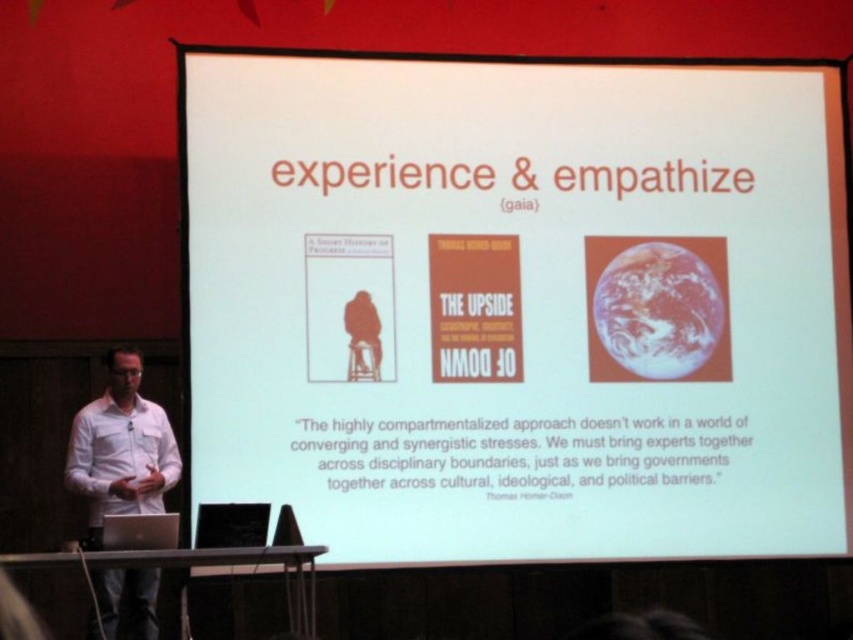
Looking at this image, can you confirm if white shirt at left is positioned above silver metallic laptop at lower left?

Yes.

Which is in front, point (86, 470) or point (129, 516)?

Point (129, 516) is in front.

Is point (132, 368) closer to viewer compared to point (146, 524)?

No, (132, 368) is behind (146, 524).

Find the location of `white shirt at left`. white shirt at left is located at coordinates (120, 449).

In the scene shown: Between white paper at center and white shirt at left, which one is positioned lower?

Positioned lower is white shirt at left.

Who is positioned more to the right, white paper at center or white shirt at left?

white paper at center

This screenshot has height=640, width=853. Describe the element at coordinates (519, 305) in the screenshot. I see `white paper at center` at that location.

Locate an element on the screen. Image resolution: width=853 pixels, height=640 pixels. white paper at center is located at coordinates (519, 305).

Which of these two, white paper at center or silver metallic laptop at lower left, stands shorter?

Standing shorter between the two is silver metallic laptop at lower left.

Between white paper at center and silver metallic laptop at lower left, which one is positioned higher?

Positioned higher is white paper at center.

Does point (416, 289) come farther from viewer compared to point (102, 541)?

That is True.

The image size is (853, 640). In order to click on white paper at center in this screenshot , I will do `click(519, 305)`.